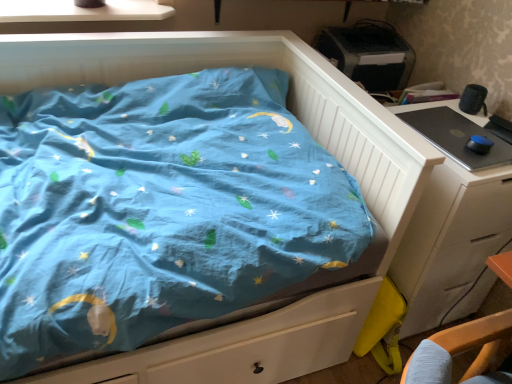
You are a GUI agent. You are given a task and a screenshot of the screen. Output one action in this format:
    pyautogui.click(x=<x>, y=<y>)
    Task: Click on the free spot below black glossy desktop at right (from a real-world perspective)
    This screenshot has width=512, height=384.
    Given the screenshot: What is the action you would take?
    pyautogui.click(x=454, y=138)